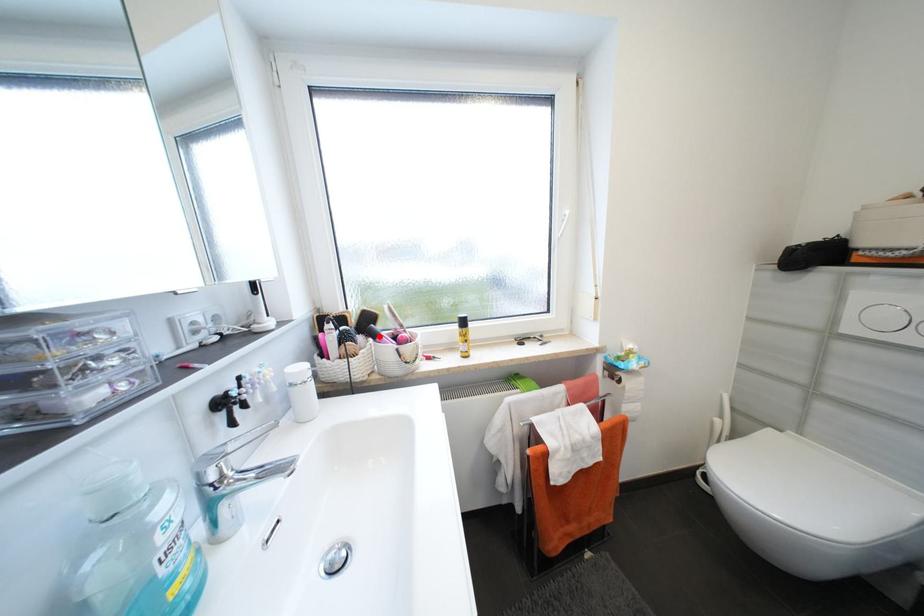
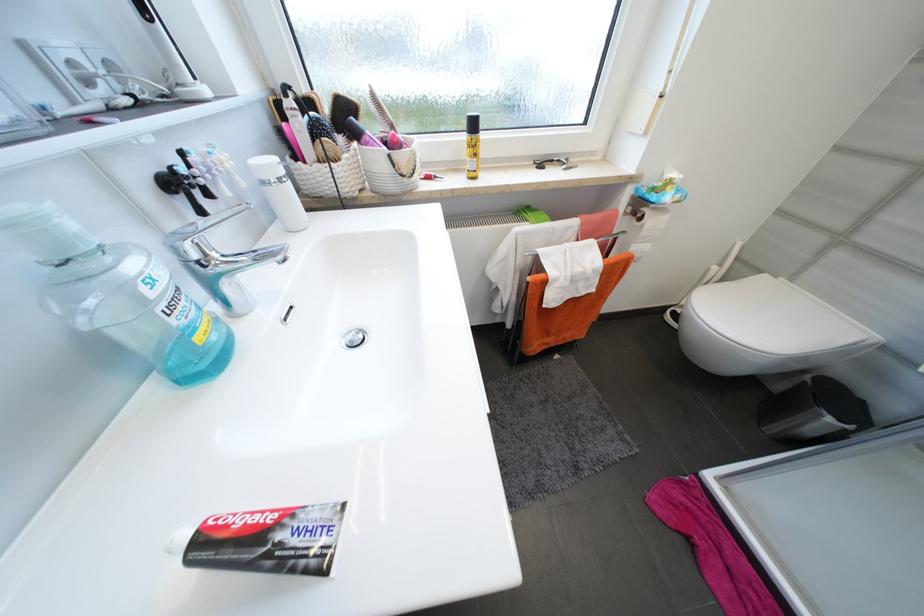
Locate, in the second image, the point that corresponds to the highlighted location in the first image.

(362, 136)